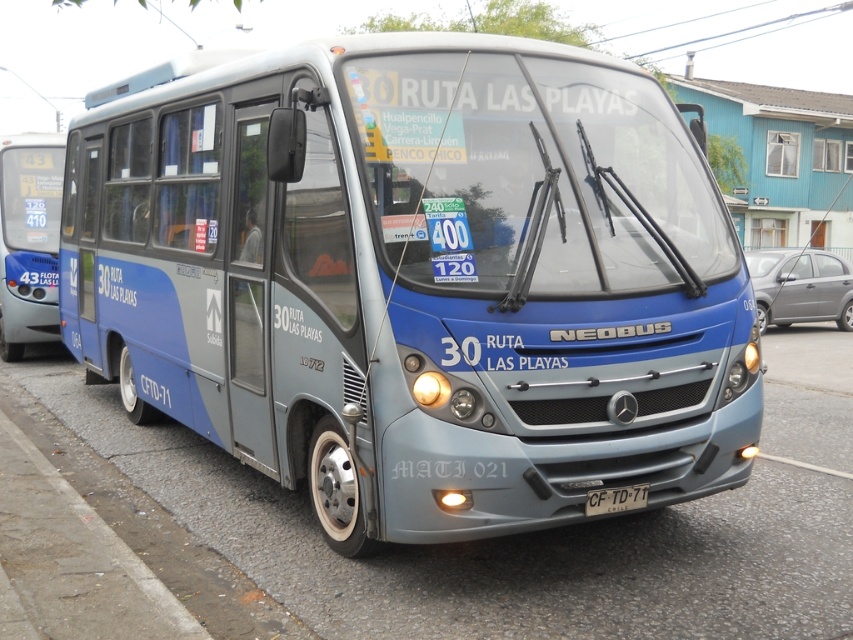
Is blue metallic bus at left wider than white plastic license plate at center?

Yes.

Is point (4, 184) in front of point (637, 496)?

That is False.

Locate an element on the screen. The height and width of the screenshot is (640, 853). blue metallic bus at left is located at coordinates (28, 240).

Who is positioned more to the left, blue metallic bus at center or blue metallic bus at left?

From the viewer's perspective, blue metallic bus at left appears more on the left side.

Which is behind, point (693, 140) or point (39, 170)?

The point (39, 170) is behind.

Where is `blue metallic bus at center`? The width and height of the screenshot is (853, 640). blue metallic bus at center is located at coordinates (416, 278).

Who is lower down, blue metallic bus at center or white plastic license plate at center?

Positioned lower is white plastic license plate at center.

In the scene shown: Can you confirm if blue metallic bus at center is thinner than white plastic license plate at center?

Incorrect, blue metallic bus at center's width is not less than white plastic license plate at center's.

Describe the element at coordinates (416, 278) in the screenshot. This screenshot has width=853, height=640. I see `blue metallic bus at center` at that location.

At what (x,y) coordinates should I click in order to perform the action: click on blue metallic bus at center. Please return your answer as a coordinate pair (x, y). This screenshot has height=640, width=853. Looking at the image, I should click on tap(416, 278).